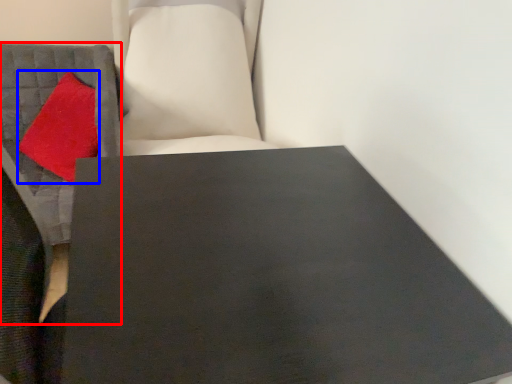
Question: Which point is further to the camera, furniture (highlighted by a red box) or throw pillow (highlighted by a blue box)?

Choices:
 (A) furniture
 (B) throw pillow

Answer: (B)